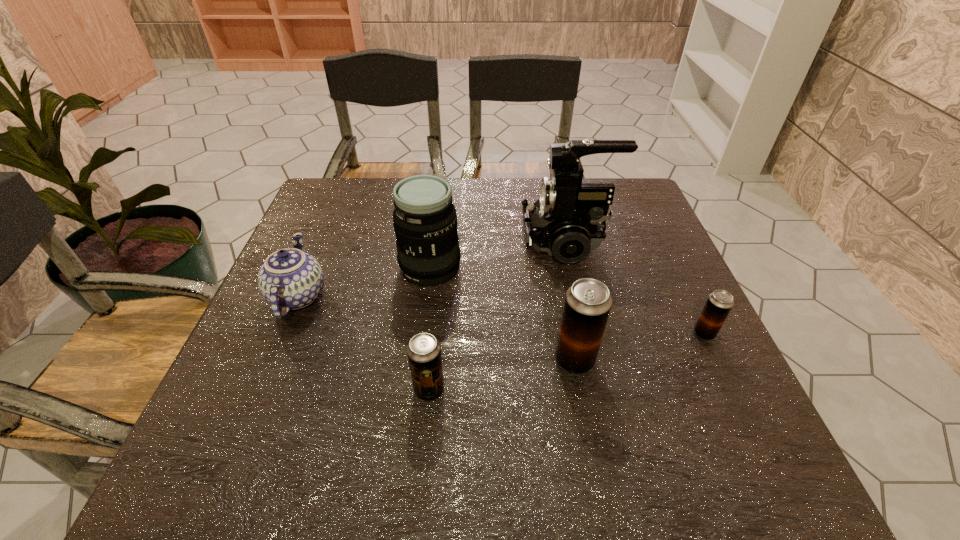
In the current image, all beer cans are evenly spaced. To maintain this equal spacing, where should an additional beer can be placed on the left? Please point out a free spot. Please provide its 2D coordinates. Your answer should be formatted as a tuple, i.e. [(x, y)], where the tuple contains the x and y coordinates of a point satisfying the conditions above.

[(265, 424)]